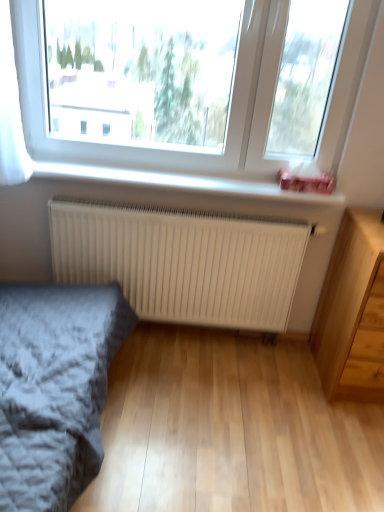
Describe the element at coordinates (54, 389) in the screenshot. The image size is (384, 512). I see `gray textured bed at lower left` at that location.

You are a GUI agent. You are given a task and a screenshot of the screen. Output one action in this format:
    pyautogui.click(x=<x>, y=<y>)
    Task: Click on the transparent glass window at upper center
    The image size is (384, 512).
    Given the screenshot: What is the action you would take?
    pyautogui.click(x=163, y=150)

Measure the distance between point (x=149, y=249) and camera.

The depth of point (x=149, y=249) is 6.68 feet.

You are a GUI agent. You are given a task and a screenshot of the screen. Output one action in this format:
    pyautogui.click(x=<x>, y=<y>)
    Task: Click on the gray textured bed at lower left
    The image size is (384, 512).
    Given the screenshot: What is the action you would take?
    pyautogui.click(x=54, y=389)

Considering the relative sizes of white matte radiator at center and light wood chest of drawers at lower right in the image provided, is white matte radiator at center smaller than light wood chest of drawers at lower right?

Indeed, white matte radiator at center has a smaller size compared to light wood chest of drawers at lower right.

From a real-world perspective, is white matte radiator at center located higher than light wood chest of drawers at lower right?

Actually, white matte radiator at center is physically below light wood chest of drawers at lower right in the real world.

From the image's perspective, which one is positioned higher, white matte radiator at center or light wood chest of drawers at lower right?

white matte radiator at center.

Can you tell me how much white matte radiator at center and light wood chest of drawers at lower right differ in facing direction?

The angle between the facing direction of white matte radiator at center and the facing direction of light wood chest of drawers at lower right is 0.436 degrees.

Is transparent glass window at upper center spatially inside gray textured bed at lower left, or outside of it?

transparent glass window at upper center is not enclosed by gray textured bed at lower left.

How much distance is there between transparent glass window at upper center and gray textured bed at lower left?

transparent glass window at upper center and gray textured bed at lower left are 94.04 centimeters apart from each other.

Who is taller, transparent glass window at upper center or gray textured bed at lower left?

Standing taller between the two is gray textured bed at lower left.

I want to click on window above the gray textured bed at lower left (from a real-world perspective), so click(x=163, y=150).

Identify the location of window on the left of light wood chest of drawers at lower right. (163, 150).

In terms of size, does light wood chest of drawers at lower right appear bigger or smaller than transparent glass window at upper center?

Considering their sizes, light wood chest of drawers at lower right takes up more space than transparent glass window at upper center.

From the picture: Is light wood chest of drawers at lower right surrounding transparent glass window at upper center?

Actually, transparent glass window at upper center is outside light wood chest of drawers at lower right.

In the image, is light wood chest of drawers at lower right on the left side or the right side of transparent glass window at upper center?

Based on their positions, light wood chest of drawers at lower right is located to the right of transparent glass window at upper center.

How much distance is there between light wood chest of drawers at lower right and white plastic window sill at upper center?

They are 23.06 inches apart.

Visually, is light wood chest of drawers at lower right positioned to the left or to the right of white plastic window sill at upper center?

light wood chest of drawers at lower right is positioned on white plastic window sill at upper center's right side.

Is light wood chest of drawers at lower right positioned far away from white plastic window sill at upper center?

No, light wood chest of drawers at lower right is not far away from white plastic window sill at upper center.

From the image's perspective, is light wood chest of drawers at lower right below white plastic window sill at upper center?

Yes, from the image's perspective, light wood chest of drawers at lower right is below white plastic window sill at upper center.

From the image's perspective, which object appears higher, transparent glass window at upper center or white matte radiator at center?

transparent glass window at upper center.

Is transparent glass window at upper center placed right next to white matte radiator at center?

No, transparent glass window at upper center is not making contact with white matte radiator at center.

Can you confirm if transparent glass window at upper center is thinner than white matte radiator at center?

No, transparent glass window at upper center is not thinner than white matte radiator at center.

Is white matte radiator at center next to white plastic window sill at upper center and touching it?

white matte radiator at center and white plastic window sill at upper center are clearly separated.

From the image's perspective, is white matte radiator at center positioned above or below white plastic window sill at upper center?

Based on their image positions, white matte radiator at center is located beneath white plastic window sill at upper center.

Find the location of `radiator located below the white plastic window sill at upper center (from the image's perspective)`. radiator located below the white plastic window sill at upper center (from the image's perspective) is located at coordinates (182, 262).

Is white plastic window sill at upper center inside or outside of light wood chest of drawers at lower right?

white plastic window sill at upper center is spatially situated outside light wood chest of drawers at lower right.

Can you confirm if white plastic window sill at upper center is smaller than light wood chest of drawers at lower right?

Yes, white plastic window sill at upper center is smaller than light wood chest of drawers at lower right.

Is the depth of white plastic window sill at upper center greater than that of light wood chest of drawers at lower right?

Yes, white plastic window sill at upper center is further from the viewer.

Could you tell me if white plastic window sill at upper center is turned towards light wood chest of drawers at lower right?

No, white plastic window sill at upper center is not turned towards light wood chest of drawers at lower right.

Locate an element on the screen. This screenshot has width=384, height=512. chest of drawers on the right of white matte radiator at center is located at coordinates (352, 311).

The height and width of the screenshot is (512, 384). Identify the location of window behind the gray textured bed at lower left. (163, 150).

When comparing their distances from transparent glass window at upper center, does white plastic window sill at upper center or gray textured bed at lower left seem further?

The object further to transparent glass window at upper center is gray textured bed at lower left.

Considering their positions, is gray textured bed at lower left positioned closer to white matte radiator at center than transparent glass window at upper center?

Based on the image, transparent glass window at upper center appears to be nearer to white matte radiator at center.

Looking at the image, which one is located further to transparent glass window at upper center, white matte radiator at center or white plastic window sill at upper center?

white matte radiator at center is further to transparent glass window at upper center.

Which object lies nearer to the anchor point transparent glass window at upper center, white plastic window sill at upper center or light wood chest of drawers at lower right?

white plastic window sill at upper center lies closer to transparent glass window at upper center than the other object.

Consider the image. Estimate the real-world distances between objects in this image. Which object is further from white plastic window sill at upper center, transparent glass window at upper center or light wood chest of drawers at lower right?

light wood chest of drawers at lower right.

From the image, which object appears to be nearer to light wood chest of drawers at lower right, gray textured bed at lower left or transparent glass window at upper center?

Based on the image, transparent glass window at upper center appears to be nearer to light wood chest of drawers at lower right.

When comparing their distances from white matte radiator at center, does light wood chest of drawers at lower right or transparent glass window at upper center seem further?

light wood chest of drawers at lower right.

Estimate the real-world distances between objects in this image. Which object is closer to gray textured bed at lower left, transparent glass window at upper center or white plastic window sill at upper center?

white plastic window sill at upper center lies closer to gray textured bed at lower left than the other object.

This screenshot has width=384, height=512. Identify the location of window between gray textured bed at lower left and white matte radiator at center along the z-axis. (163, 150).

This screenshot has height=512, width=384. I want to click on window between white plastic window sill at upper center and light wood chest of drawers at lower right in the horizontal direction, so click(x=163, y=150).

Locate an element on the screen. The image size is (384, 512). window between gray textured bed at lower left and light wood chest of drawers at lower right from left to right is located at coordinates (163, 150).

Locate an element on the screen. window positioned between gray textured bed at lower left and white plastic window sill at upper center from near to far is located at coordinates (163, 150).